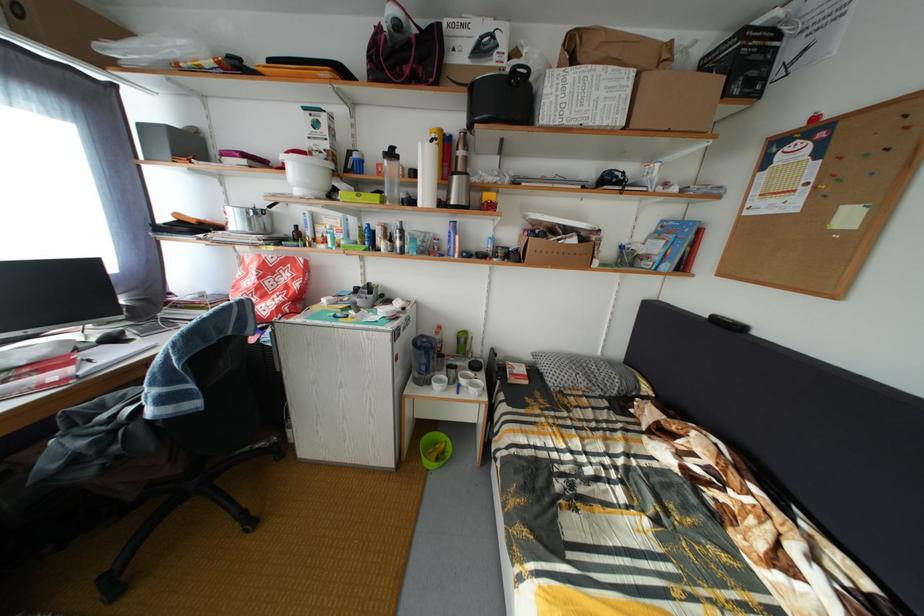
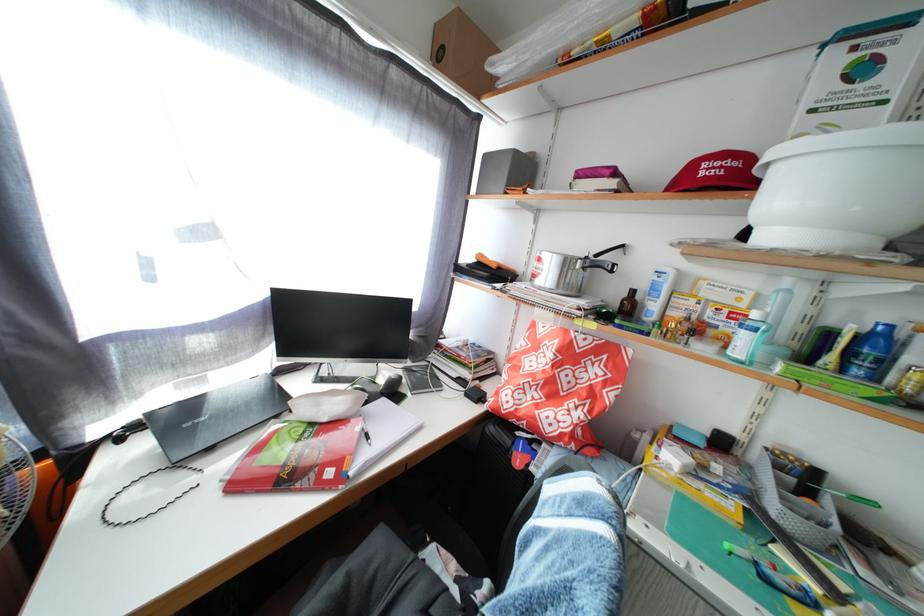
Find the pixel in the second image that matches the point at 103,345 in the first image.

(390, 387)